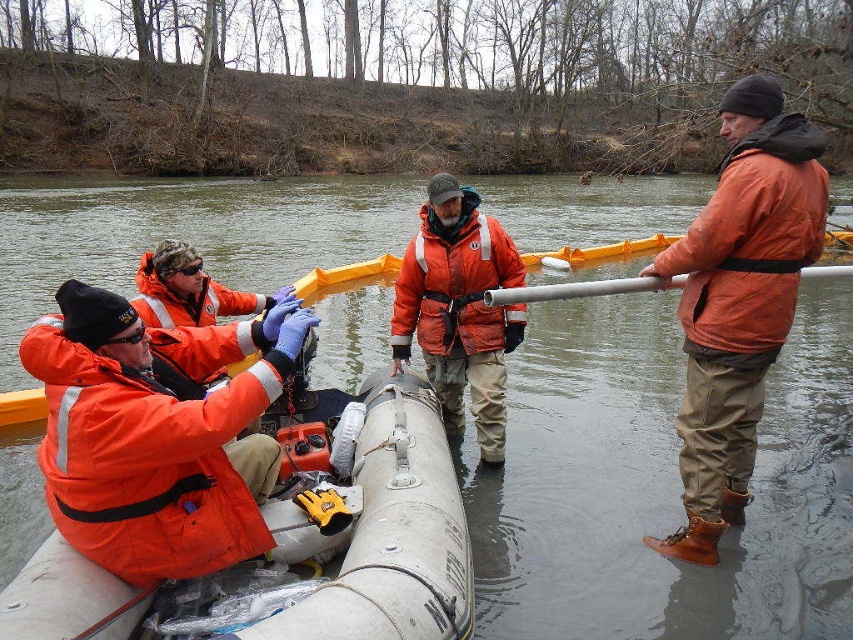
Does orange matte jacket at left appear under white rubber boat at center?

No, orange matte jacket at left is not below white rubber boat at center.

Who is lower down, orange matte jacket at left or white rubber boat at center?

white rubber boat at center is lower down.

This screenshot has height=640, width=853. What do you see at coordinates (154, 432) in the screenshot?
I see `orange matte jacket at left` at bounding box center [154, 432].

Identify the location of orange matte jacket at left. point(154,432).

Does gray rubber tube at center have a larger size compared to white rubber boat at center?

Correct, gray rubber tube at center is larger in size than white rubber boat at center.

Which is more to the left, gray rubber tube at center or white rubber boat at center?

gray rubber tube at center

Is point (289, 218) farther from camera compared to point (409, 388)?

Yes, point (289, 218) is behind point (409, 388).

Where is `gray rubber tube at center`? gray rubber tube at center is located at coordinates (660, 484).

What do you see at coordinates (154, 432) in the screenshot? The width and height of the screenshot is (853, 640). I see `orange matte jacket at left` at bounding box center [154, 432].

Find the location of a particular element. This screenshot has width=853, height=640. orange matte jacket at left is located at coordinates (154, 432).

The height and width of the screenshot is (640, 853). I want to click on orange matte jacket at left, so click(154, 432).